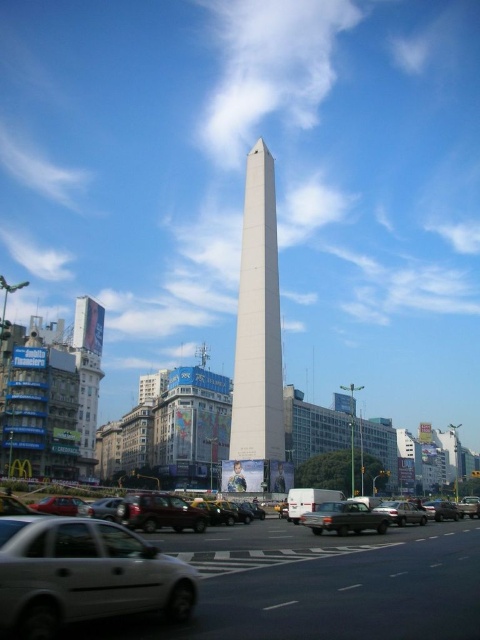
What object is located at the coordinates point (344, 516) in the image?

The point (344, 516) corresponds to the matte gray sedan at center.